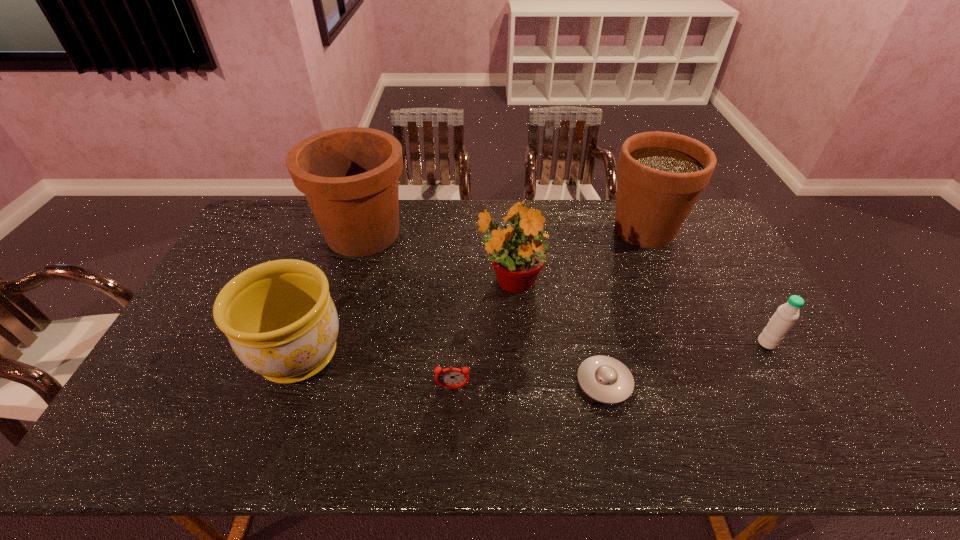
Where is `object that ranks as the second closest to the saucer`? object that ranks as the second closest to the saucer is located at coordinates (452, 378).

I want to click on object identified as the closest to the third flowerpot from left to right, so click(605, 379).

Identify which flowerpot is the third nearest to the alarm clock. Please provide its 2D coordinates. Your answer should be formatted as a tuple, i.e. [(x, y)], where the tuple contains the x and y coordinates of a point satisfying the conditions above.

[(349, 176)]

Choose which flowerpot is the fourth nearest neighbor to the third object from right to left. Please provide its 2D coordinates. Your answer should be formatted as a tuple, i.e. [(x, y)], where the tuple contains the x and y coordinates of a point satisfying the conditions above.

[(349, 176)]

At what (x,y) coordinates should I click in order to perform the action: click on free space that satisfies the following two spatial constraints: 1. on the back side of the fifth tallest object; 2. on the left side of the shortest flowerpot. Please return your answer as a coordinate pair (x, y). Looking at the image, I should click on (303, 343).